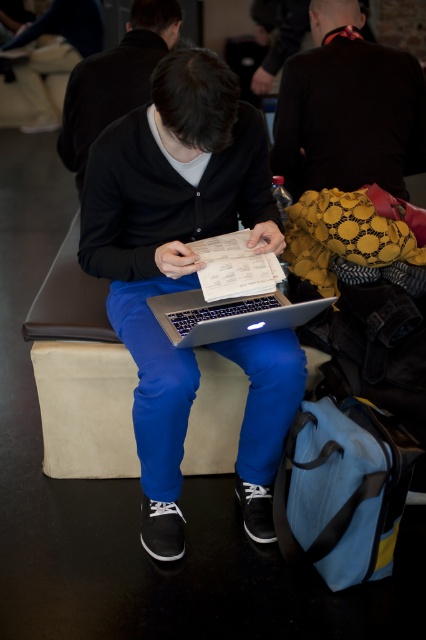
You are a photographer trying to capture a candid shot of the person without them noticing. You have a camera with a 100mm lens that has a narrow field of view. The dark brown leather jacket at upper center and the sleek silver laptop at center are both in your frame. Which object should you focus on to ensure both are in focus, considering their sizes and positions?

The dark brown leather jacket at upper center is larger in size than the sleek silver laptop at center, so focusing on the jacket would ensure both are in focus as it occupies more of the frame, making it easier to maintain sharpness for both objects.

You are a person who wants to place a small sticker on the exact center of the matte black laptop at center. Given that the coordinates of the center are provided as point [170,244], can you confirm if this point is located on the matte black laptop at center?

Yes, the point [170,244] is located on the matte black laptop at center according to the provided coordinates.

Based on the photo, you are a delivery person who needs to place a matte black laptop at center and a matte black hoodie at center into a box that can only hold items up to 12 inches in length. Knowing that the hoodie is 11 inches long, can both items fit in the box?

The matte black laptop at center is larger than the matte black hoodie at center. Since the hoodie is 11 inches long and the laptop is larger, it might exceed the 12 inches limit. Therefore, both items may not fit in the box.